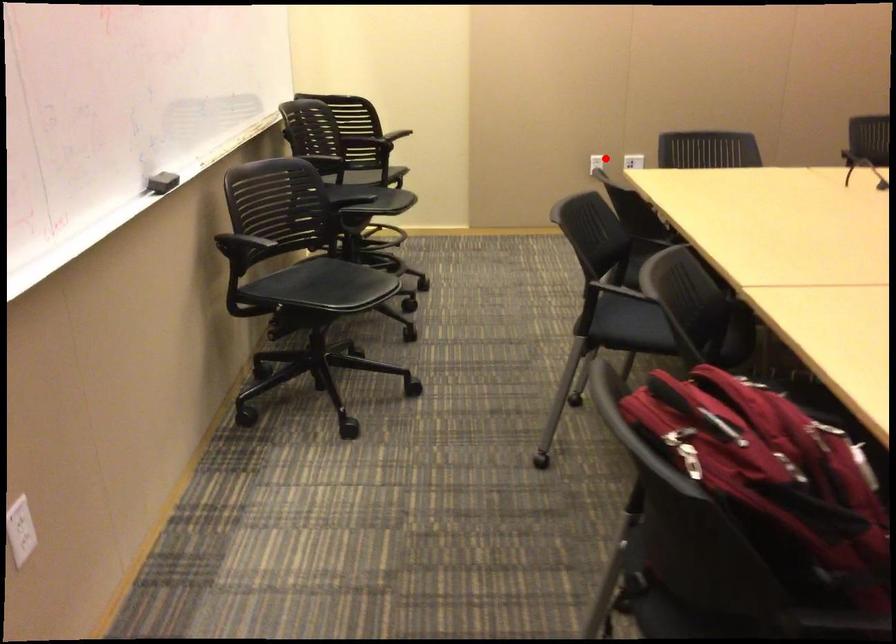
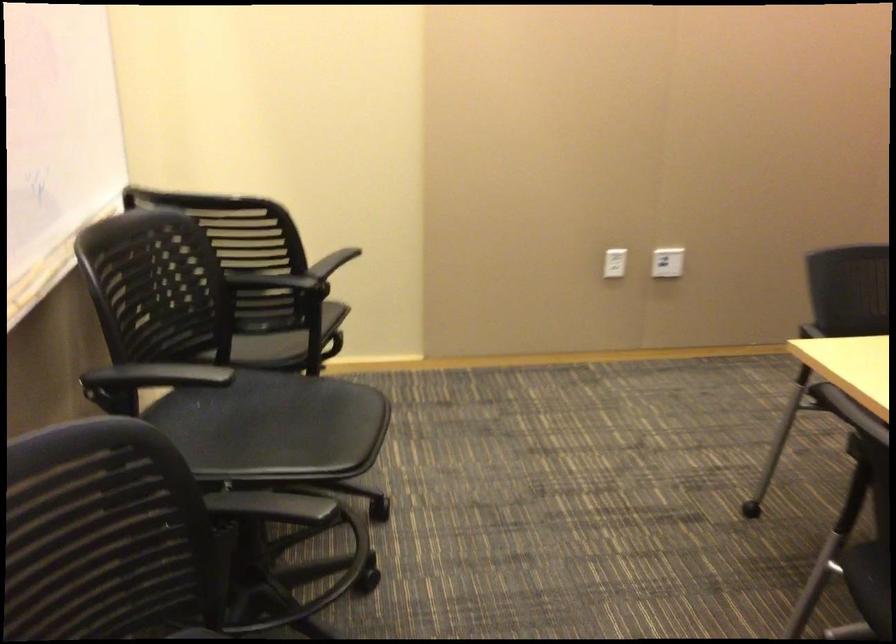
Question: I am providing you with two images of the same scene from different viewpoints. Given a red point in image1, look at the same physical point in image2. Is it:

Choices:
 (A) Closer to the viewpoint
 (B) Farther from the viewpoint

Answer: (A)